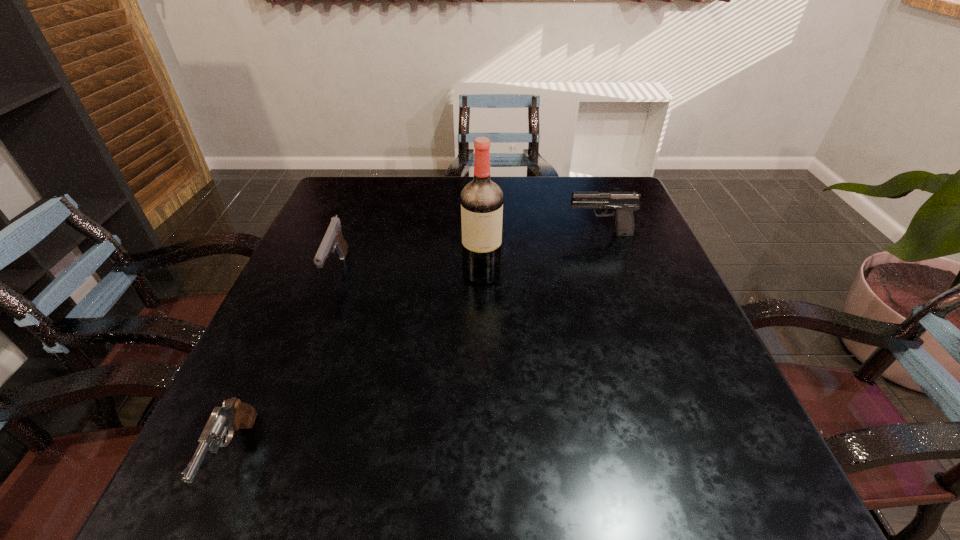
This screenshot has height=540, width=960. I want to click on vacant space located aim along the barrel of the rightmost object, so click(x=449, y=234).

This screenshot has width=960, height=540. Identify the location of vacant region located 0.070m aim along the barrel of the rightmost object. (540, 234).

The height and width of the screenshot is (540, 960). Identify the location of vacant space located at the barrel of the second farthest pistol. (304, 359).

Locate an element on the screen. object that is at the near edge is located at coordinates (233, 415).

At what (x,y) coordinates should I click in order to perform the action: click on object located in the right edge section of the desktop. Please return your answer as a coordinate pair (x, y). Looking at the image, I should click on (624, 203).

Image resolution: width=960 pixels, height=540 pixels. Find the location of `object present at the near left corner`. object present at the near left corner is located at coordinates [233, 415].

In the image, there is a desktop. What are the coordinates of `vacant region at the far edge` in the screenshot? It's located at (515, 186).

Image resolution: width=960 pixels, height=540 pixels. I want to click on free space at the near edge of the desktop, so click(508, 479).

In the image, there is a desktop. At what (x,y) coordinates should I click in order to perform the action: click on vacant area at the left edge. Please return your answer as a coordinate pair (x, y). This screenshot has width=960, height=540. Looking at the image, I should click on (254, 367).

This screenshot has height=540, width=960. In order to click on vacant region at the right edge of the desktop in this screenshot , I will do `click(618, 288)`.